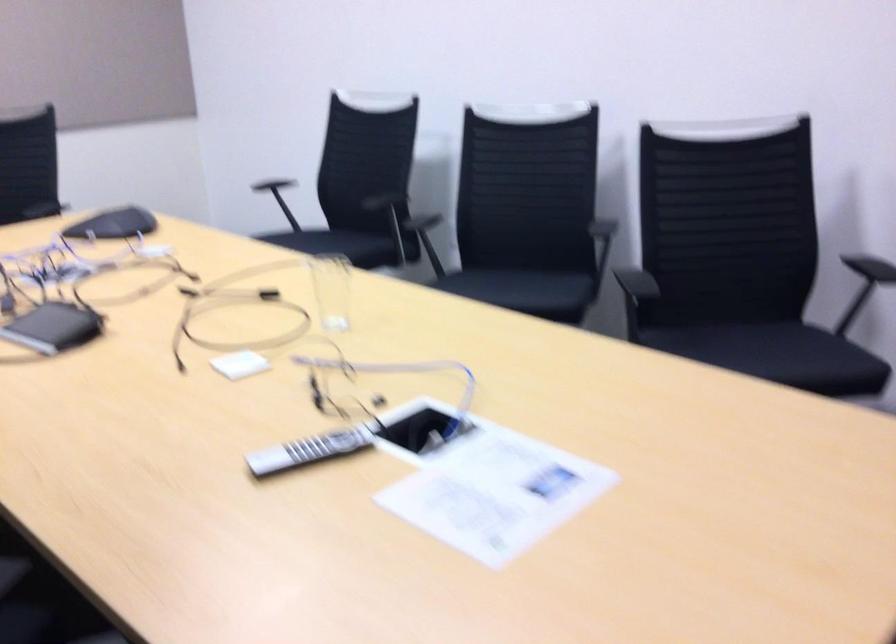
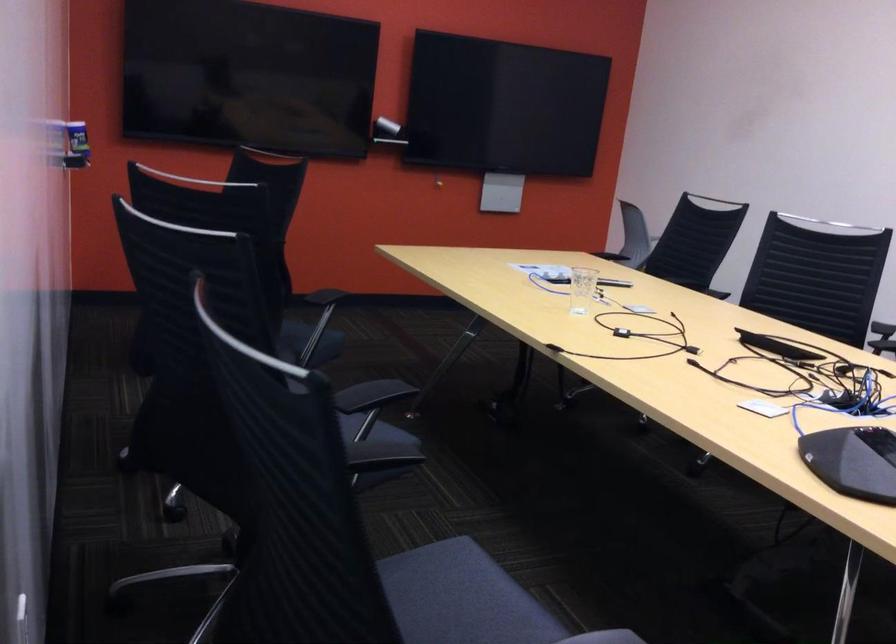
Question: I am providing you with two images of the same scene from different viewpoints. After the viewpoint changes to image2, which objects are now occluded?

Choices:
 (A) black conference phone
 (B) black chair sitting surface
 (C) chair sitting surface
 (D) small book

Answer: (C)